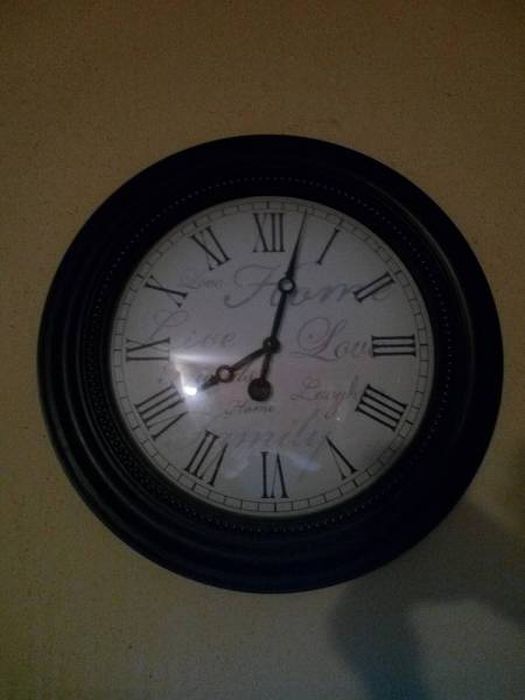
At what (x,y) coordinates should I click in order to perform the action: click on kitchen. Please return your answer as a coordinate pair (x, y). The image size is (525, 700). Looking at the image, I should click on (341, 344).